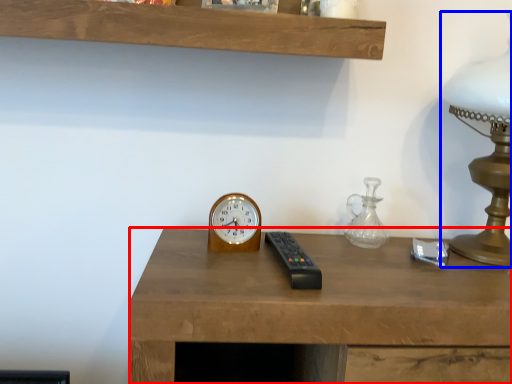
Question: Which of the following is the closest to the observer, desk (highlighted by a red box) or table lamp (highlighted by a blue box)?

Choices:
 (A) desk
 (B) table lamp

Answer: (A)